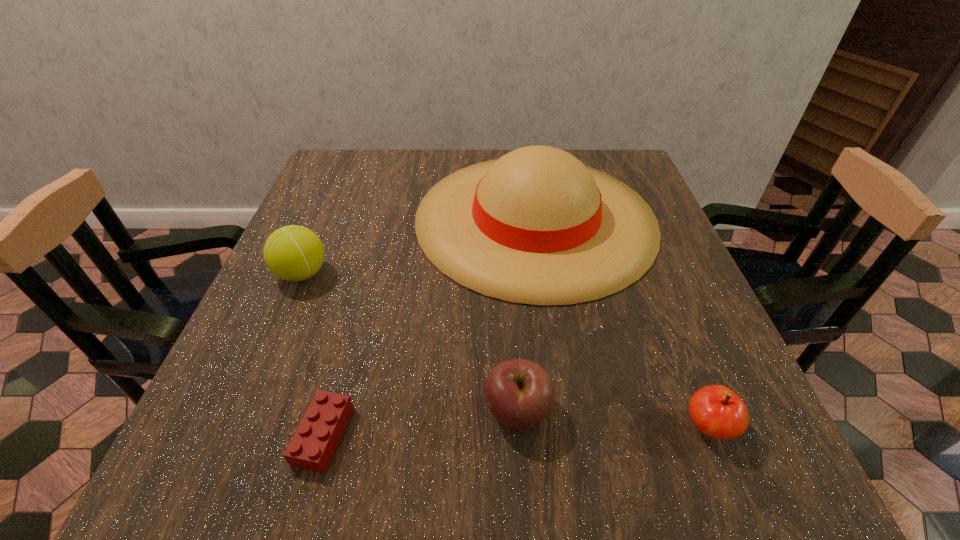
Locate an element on the screen. This screenshot has width=960, height=540. vacant area that lies between the leftmost object and the left apple is located at coordinates (410, 342).

I want to click on unoccupied area between the left apple and the right apple, so point(612,419).

Locate an element on the screen. This screenshot has width=960, height=540. vacant space that's between the fourth object from right to left and the left apple is located at coordinates (420, 423).

This screenshot has height=540, width=960. Find the location of `free area in between the tennis ball and the sombrero`. free area in between the tennis ball and the sombrero is located at coordinates (419, 246).

You are a GUI agent. You are given a task and a screenshot of the screen. Output one action in this format:
    pyautogui.click(x=<x>, y=<y>)
    Task: Click on the vacant space in between the leftmost object and the Lego
    Image resolution: width=960 pixels, height=540 pixels.
    Given the screenshot: What is the action you would take?
    pyautogui.click(x=313, y=355)

Locate an element on the screen. This screenshot has width=960, height=540. vacant space that is in between the sombrero and the left apple is located at coordinates pyautogui.click(x=526, y=314).

This screenshot has height=540, width=960. In order to click on free space between the tallest object and the left apple in this screenshot , I will do `click(526, 314)`.

You are a GUI agent. You are given a task and a screenshot of the screen. Output one action in this format:
    pyautogui.click(x=<x>, y=<y>)
    Task: Click on the vacant region between the left apple and the right apple
    
    Given the screenshot: What is the action you would take?
    pyautogui.click(x=612, y=419)

Find the location of `object that stands as the third closest to the leftmost object`. object that stands as the third closest to the leftmost object is located at coordinates (519, 393).

Locate an element on the screen. The width and height of the screenshot is (960, 540). object identified as the fourth closest to the shortest object is located at coordinates (718, 412).